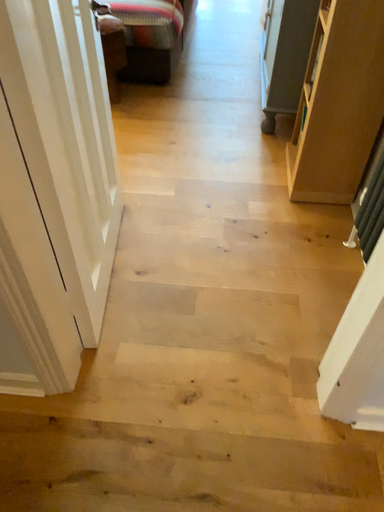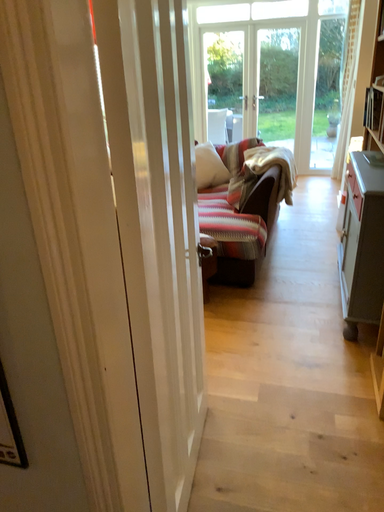
Question: Which way did the camera rotate in the video?

Choices:
 (A) rotated upward
 (B) rotated downward

Answer: (A)